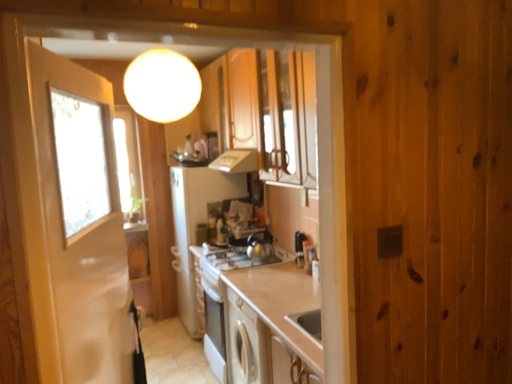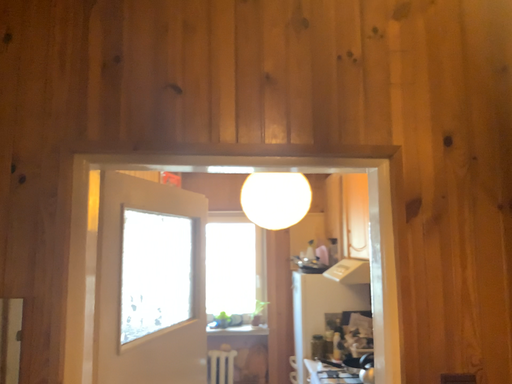
Question: Which way did the camera rotate in the video?

Choices:
 (A) rotated right
 (B) rotated left

Answer: (B)